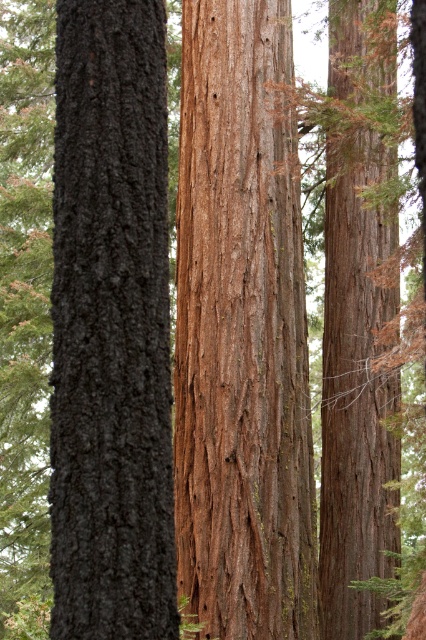
Question: Which object appears closest to the camera in this image?

Choices:
 (A) brown rough bark tree at center
 (B) dark gray bark tree at left

Answer: (B)

Question: Is dark gray bark tree at left bigger than brown rough bark tree at right?

Choices:
 (A) yes
 (B) no

Answer: (B)

Question: Is brown rough bark tree at center bigger than dark gray bark tree at left?

Choices:
 (A) yes
 (B) no

Answer: (A)

Question: Which of these objects is positioned closest to the brown rough bark tree at center?

Choices:
 (A) dark gray bark tree at left
 (B) brown rough bark tree at right

Answer: (B)

Question: Among these objects, which one is farthest from the camera?

Choices:
 (A) brown rough bark tree at center
 (B) brown rough bark tree at right

Answer: (B)

Question: Is brown rough bark tree at center below dark gray bark tree at left?

Choices:
 (A) no
 (B) yes

Answer: (A)